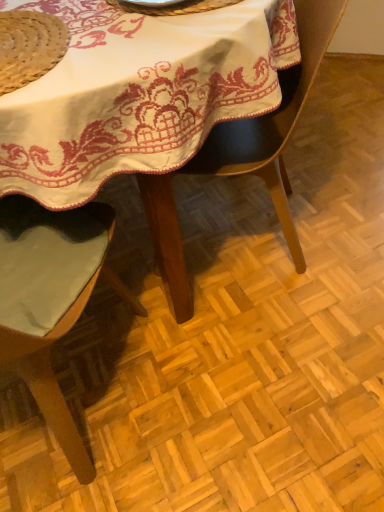
Question: Is white embroidered tablecloth at center outside of black leather chair at center, the first chair viewed from the right?

Choices:
 (A) no
 (B) yes

Answer: (B)

Question: Is white embroidered tablecloth at center positioned before black leather chair at center, the second chair in the left-to-right sequence?

Choices:
 (A) yes
 (B) no

Answer: (A)

Question: Does white embroidered tablecloth at center have a larger size compared to black leather chair at center, the first chair viewed from the right?

Choices:
 (A) yes
 (B) no

Answer: (A)

Question: From the image's perspective, is white embroidered tablecloth at center above black leather chair at center, the first chair viewed from the right?

Choices:
 (A) no
 (B) yes

Answer: (B)

Question: Does white embroidered tablecloth at center have a lesser height compared to black leather chair at center, the second chair in the left-to-right sequence?

Choices:
 (A) yes
 (B) no

Answer: (A)

Question: From a real-world perspective, is white embroidered tablecloth at center located beneath black leather chair at center, the second chair in the left-to-right sequence?

Choices:
 (A) yes
 (B) no

Answer: (B)

Question: Does black leather chair at center, the first chair viewed from the right, have a smaller size compared to natural straw hat at upper left?

Choices:
 (A) no
 (B) yes

Answer: (A)

Question: Is natural straw hat at upper left at the back of black leather chair at center, the first chair viewed from the right?

Choices:
 (A) yes
 (B) no

Answer: (B)

Question: Is black leather chair at center, the first chair viewed from the right, to the left of natural straw hat at upper left from the viewer's perspective?

Choices:
 (A) no
 (B) yes

Answer: (A)

Question: From a real-world perspective, is black leather chair at center, the second chair in the left-to-right sequence, over natural straw hat at upper left?

Choices:
 (A) no
 (B) yes

Answer: (A)

Question: Considering the relative sizes of black leather chair at center, the first chair viewed from the right, and natural straw hat at upper left in the image provided, is black leather chair at center, the first chair viewed from the right, thinner than natural straw hat at upper left?

Choices:
 (A) yes
 (B) no

Answer: (B)

Question: Does black leather chair at center, the first chair viewed from the right, have a greater width compared to natural straw hat at upper left?

Choices:
 (A) no
 (B) yes

Answer: (B)

Question: Can you confirm if green fabric chair at left, which appears as the 1th chair when viewed from the left, is smaller than black leather chair at center, the second chair in the left-to-right sequence?

Choices:
 (A) yes
 (B) no

Answer: (B)